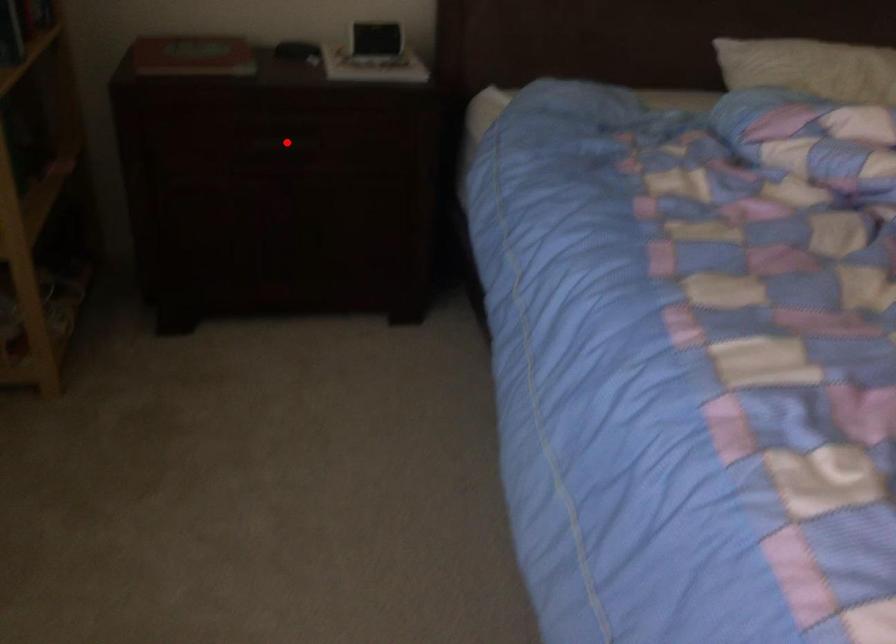
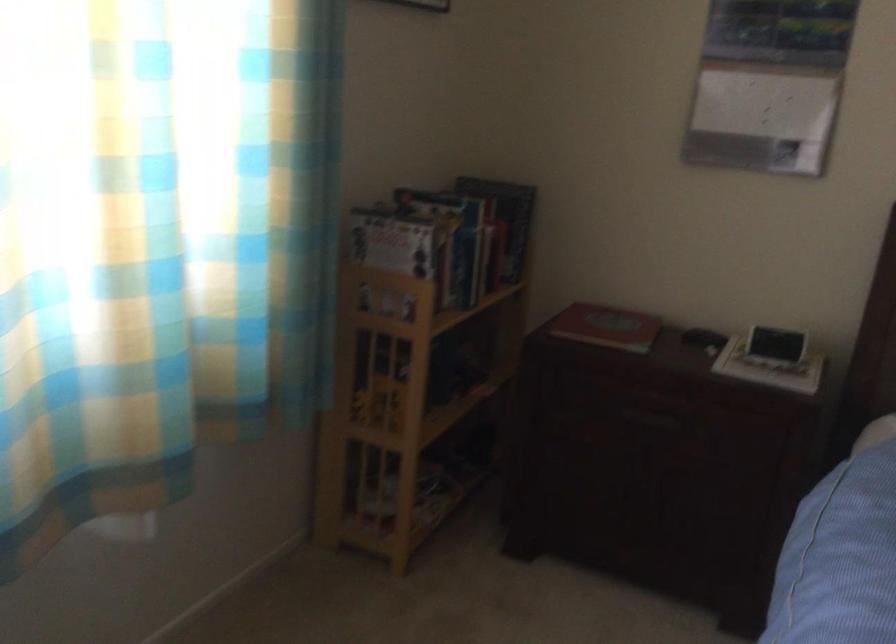
In the second image, find the point that corresponds to the highlighted location in the first image.

(652, 415)